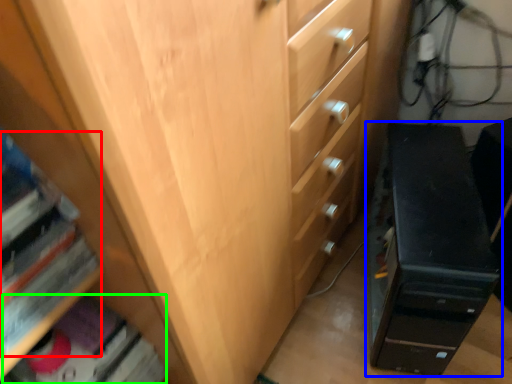
Question: Which object is the farthest from book (highlighted by a red box)? Choose among these: chest of drawers (highlighted by a blue box) or book (highlighted by a green box).

Choices:
 (A) chest of drawers
 (B) book

Answer: (A)